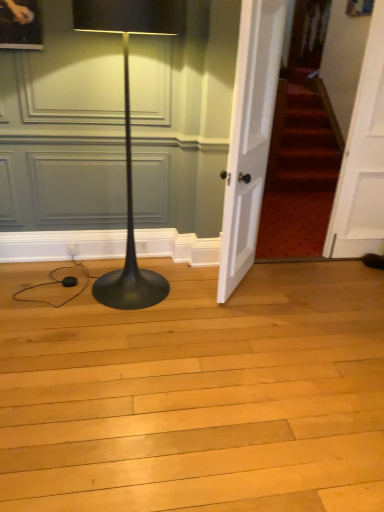
Question: From a real-world perspective, is white wooden door at center, the first door in the left-to-right sequence, above or below black glossy floor lamp at left?

Choices:
 (A) above
 (B) below

Answer: (A)

Question: In terms of height, does white wooden door at center, the first door in the left-to-right sequence, look taller or shorter compared to black glossy floor lamp at left?

Choices:
 (A) short
 (B) tall

Answer: (B)

Question: Which object is the closest to the white wooden door at center, the second door when ordered from right to left?

Choices:
 (A) black glossy floor lamp at left
 (B) white wooden door at right, the 1th door in the right-to-left sequence

Answer: (A)

Question: Which object is positioned farthest from the black glossy floor lamp at left?

Choices:
 (A) white wooden door at right, the second door viewed from the left
 (B) white wooden door at center, the first door in the left-to-right sequence

Answer: (A)